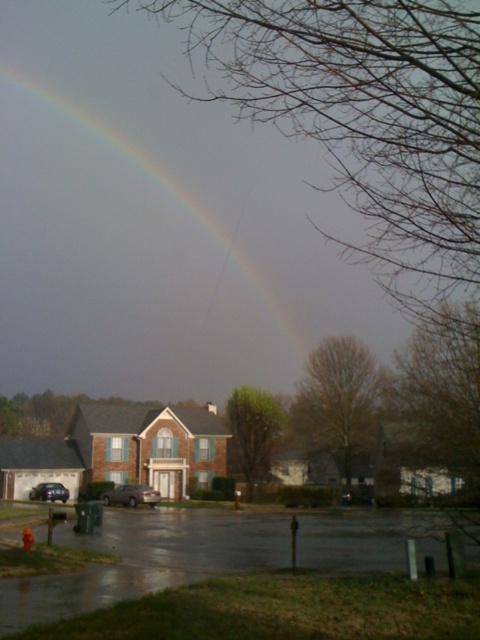
Question: Observing the image, what is the correct spatial positioning of rainbow at upper center in reference to satin gold sedan at center?

Choices:
 (A) right
 (B) left

Answer: (B)

Question: Which point is farther from the camera taking this photo?

Choices:
 (A) (149, 541)
 (B) (36, 499)

Answer: (B)

Question: Which is farther from the wet asphalt at lower center?

Choices:
 (A) shiny black sedan at lower left
 (B) satin gold sedan at center
 (C) rainbow at upper center

Answer: (C)

Question: Is rainbow at upper center in front of wet asphalt at lower center?

Choices:
 (A) yes
 (B) no

Answer: (B)

Question: Which point is farther from the camera taking this photo?

Choices:
 (A) (187, 193)
 (B) (60, 484)
 (C) (103, 493)
 (D) (337, 557)

Answer: (A)

Question: Does satin gold sedan at center come behind shiny black sedan at lower left?

Choices:
 (A) yes
 (B) no

Answer: (B)